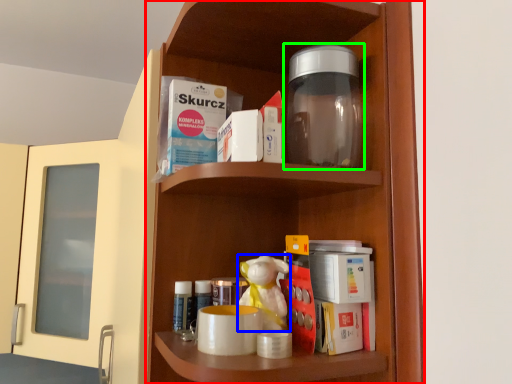
Question: Estimate the real-world distances between objects in this image. Which object is farther from shelf (highlighted by a red box), toy (highlighted by a blue box) or bottle (highlighted by a green box)?

Choices:
 (A) toy
 (B) bottle

Answer: (A)